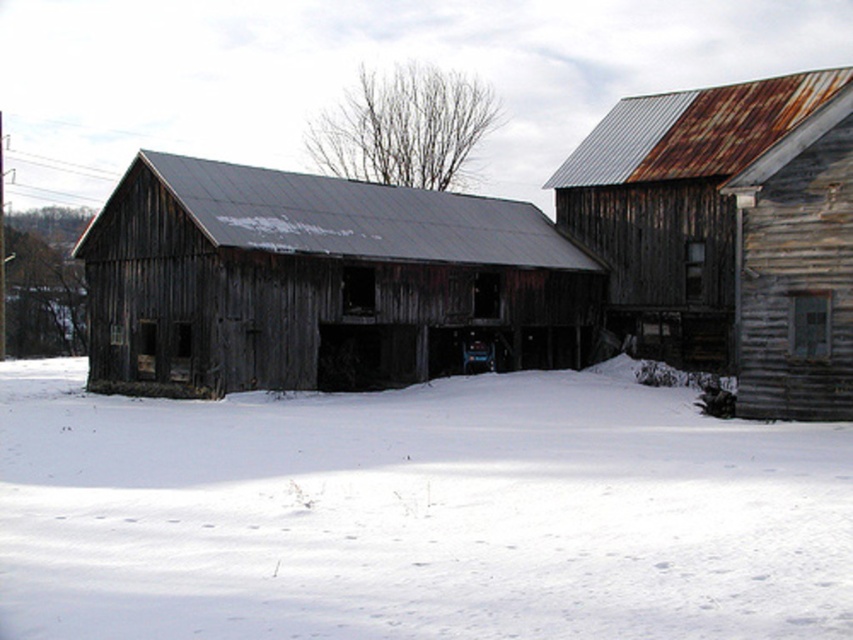
Question: Which object is closer to the camera taking this photo?

Choices:
 (A) white powdery snow at center
 (B) rusty metal hut at upper right
 (C) rusty wood barn at center

Answer: (A)

Question: Is white powdery snow at center closer to camera compared to rusty metal hut at upper right?

Choices:
 (A) no
 (B) yes

Answer: (B)

Question: Which point appears farthest from the camera in this image?

Choices:
 (A) (665, 145)
 (B) (305, 349)
 (C) (734, 513)

Answer: (A)

Question: Is white powdery snow at center thinner than rusty wood barn at center?

Choices:
 (A) no
 (B) yes

Answer: (A)

Question: Which of the following is the closest to the observer?

Choices:
 (A) rusty wood barn at center
 (B) rusty metal hut at upper right

Answer: (B)

Question: Considering the relative positions of white powdery snow at center and rusty metal hut at upper right in the image provided, where is white powdery snow at center located with respect to rusty metal hut at upper right?

Choices:
 (A) left
 (B) right

Answer: (A)